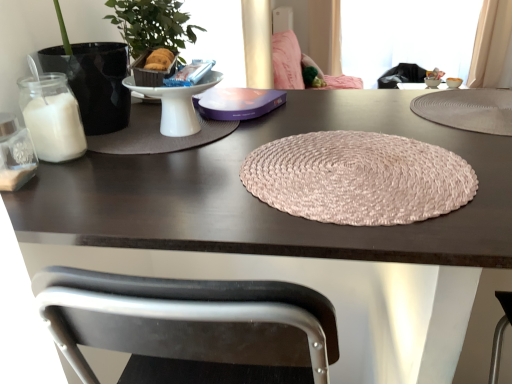
The image size is (512, 384). Describe the element at coordinates (15, 154) in the screenshot. I see `clear glass candle holder at left` at that location.

The height and width of the screenshot is (384, 512). What do you see at coordinates (490, 43) in the screenshot?
I see `beige fabric curtain at upper right` at bounding box center [490, 43].

The height and width of the screenshot is (384, 512). Identify the location of matte black placemat at left, the 1th mat positioned from the left. (155, 134).

Image resolution: width=512 pixels, height=384 pixels. Find the location of `pink woven placemat at center`. pink woven placemat at center is located at coordinates (358, 178).

Where is `transparent plastic window screen at upper right`? transparent plastic window screen at upper right is located at coordinates (407, 36).

Image resolution: width=512 pixels, height=384 pixels. What are the coordinates of `beige woven mat at upper right, the 1th mat from the right` in the screenshot? It's located at (468, 109).

At what (x,y) coordinates should I click in order to perform the action: click on green leafy plant at left. Please return your answer as a coordinate pair (x, y). Looking at the image, I should click on point(151,32).

Can you tell me how much transparent plastic window screen at upper right and pink woven placemat at center differ in facing direction?

The angular difference between transparent plastic window screen at upper right and pink woven placemat at center is 180 degrees.

Is transparent plastic window screen at upper right facing away from pink woven placemat at center?

That's not correct — transparent plastic window screen at upper right is not looking away from pink woven placemat at center.

Considering the sizes of objects transparent plastic window screen at upper right and pink woven placemat at center in the image provided, who is thinner, transparent plastic window screen at upper right or pink woven placemat at center?

transparent plastic window screen at upper right is thinner.

Does point (130, 15) appear closer or farther from the camera than point (390, 58)?

Point (130, 15) appears to be closer to the viewer than point (390, 58).

From the image's perspective, who appears lower, green leafy plant at left or transparent plastic window screen at upper right?

green leafy plant at left, from the image's perspective.

Which of these two, green leafy plant at left or transparent plastic window screen at upper right, is wider?

With larger width is transparent plastic window screen at upper right.

Which object is closer to the camera taking this photo, beige woven mat at upper right, the 2th mat from the left, or transparent plastic window screen at upper right?

beige woven mat at upper right, the 2th mat from the left, is closer to the camera.

Could you measure the distance between beige woven mat at upper right, the 2th mat from the left, and transparent plastic window screen at upper right?

They are 12.11 feet apart.

Is beige woven mat at upper right, the 1th mat from the right, shorter than transparent plastic window screen at upper right?

Indeed, beige woven mat at upper right, the 1th mat from the right, has a lesser height compared to transparent plastic window screen at upper right.

Is point (510, 96) closer or farther from the camera than point (446, 7)?

Point (510, 96) appears to be closer to the viewer than point (446, 7).

Can you confirm if beige fabric curtain at upper right is wider than green leafy plant at left?

Incorrect, the width of beige fabric curtain at upper right does not surpass that of green leafy plant at left.

Between point (481, 37) and point (148, 21), which one is positioned behind?

The point (481, 37) is behind.

Does beige fabric curtain at upper right lie in front of green leafy plant at left?

That is False.

Identify the location of houseplant in front of the beige fabric curtain at upper right. Image resolution: width=512 pixels, height=384 pixels. [x=151, y=32].

Is pink woven placemat at center far from clear glass candle holder at left?

pink woven placemat at center is actually quite close to clear glass candle holder at left.

Is pink woven placemat at center positioned in front of clear glass candle holder at left?

Yes, it is in front of clear glass candle holder at left.

At what (x,y) coordinates should I click in order to perform the action: click on yoga mat located below the clear glass candle holder at left (from the image's perspective). Please return your answer as a coordinate pair (x, y). The height and width of the screenshot is (384, 512). Looking at the image, I should click on (358, 178).

Is pink woven placemat at center facing away from clear glass candle holder at left?

pink woven placemat at center does not have its back to clear glass candle holder at left.

Can you confirm if transparent plastic window screen at upper right is taller than clear glass candle holder at left?

Correct, transparent plastic window screen at upper right is much taller as clear glass candle holder at left.

Is transparent plastic window screen at upper right next to clear glass candle holder at left and touching it?

No, transparent plastic window screen at upper right is not in contact with clear glass candle holder at left.

From a real-world perspective, does transparent plastic window screen at upper right sit lower than clear glass candle holder at left?

Yes, from a real-world perspective, transparent plastic window screen at upper right is under clear glass candle holder at left.

Could you tell me if transparent plastic window screen at upper right is facing clear glass candle holder at left?

Yes.

Is green leafy plant at left spatially inside clear glass candle holder at left, or outside of it?

The correct answer is: outside.

What are the coordinates of `candle holder below the green leafy plant at left (from the image's perspective)` in the screenshot? It's located at (15, 154).

Is green leafy plant at left next to clear glass candle holder at left?

No, green leafy plant at left is not in contact with clear glass candle holder at left.

Could you tell me if green leafy plant at left is facing clear glass candle holder at left?

No.

There is a transparent plastic window screen at upper right. Where is `yoga mat above it (from a real-world perspective)`? yoga mat above it (from a real-world perspective) is located at coordinates (358, 178).

In order to click on houseplant in front of the transparent plastic window screen at upper right in this screenshot , I will do `click(151, 32)`.

From the image, which object appears to be nearer to green leafy plant at left, beige fabric curtain at upper right or transparent plastic window screen at upper right?

The object closer to green leafy plant at left is beige fabric curtain at upper right.

Estimate the real-world distances between objects in this image. Which object is further from beige woven mat at upper right, the 2th mat from the left, matte black placemat at left, the 1th mat positioned from the left, or transparent plastic window screen at upper right?

Among the two, transparent plastic window screen at upper right is located further to beige woven mat at upper right, the 2th mat from the left.

When comparing their distances from green leafy plant at left, does matte black placemat at left, the 1th mat positioned from the left, or beige woven mat at upper right, the 2th mat from the left, seem closer?

Among the two, matte black placemat at left, the 1th mat positioned from the left, is located nearer to green leafy plant at left.

Which object lies further to the anchor point pink woven placemat at center, beige fabric curtain at upper right or green leafy plant at left?

beige fabric curtain at upper right is further to pink woven placemat at center.

When comparing their distances from pink woven placemat at center, does transparent plastic window screen at upper right or green leafy plant at left seem closer?

green leafy plant at left lies closer to pink woven placemat at center than the other object.

Looking at the image, which one is located closer to beige fabric curtain at upper right, beige woven mat at upper right, the 1th mat from the right, or clear glass candle holder at left?

The object closer to beige fabric curtain at upper right is beige woven mat at upper right, the 1th mat from the right.

From the image, which object appears to be farther from green leafy plant at left, clear glass candle holder at left or transparent plastic window screen at upper right?

Based on the image, transparent plastic window screen at upper right appears to be further to green leafy plant at left.

Looking at the image, which one is located closer to beige fabric curtain at upper right, matte black placemat at left, the 1th mat positioned from the left, or pink woven placemat at center?

Among the two, pink woven placemat at center is located nearer to beige fabric curtain at upper right.

The width and height of the screenshot is (512, 384). In order to click on mat between matte black placemat at left, which is the second mat in right-to-left order, and beige fabric curtain at upper right from front to back in this screenshot , I will do `click(468, 109)`.

Find the location of `houseplant located between clear glass candle holder at left and beige woven mat at upper right, the 2th mat from the left, in the left-right direction`. houseplant located between clear glass candle holder at left and beige woven mat at upper right, the 2th mat from the left, in the left-right direction is located at coordinates (151, 32).

You are a GUI agent. You are given a task and a screenshot of the screen. Output one action in this format:
    pyautogui.click(x=<x>, y=<y>)
    Task: Click on the houseplant positioned between matte black placemat at left, which is the second mat in right-to-left order, and transparent plastic window screen at upper right from near to far
    
    Given the screenshot: What is the action you would take?
    pyautogui.click(x=151, y=32)

Locate an element on the screen. yoga mat situated between clear glass candle holder at left and beige woven mat at upper right, the 1th mat from the right, from left to right is located at coordinates (x=358, y=178).